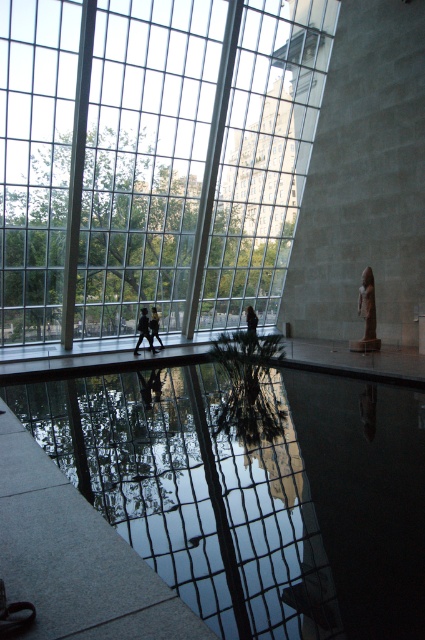
Question: Considering the real-world distances, which object is farthest from the transparent glass pool at center?

Choices:
 (A) dark hair person at center
 (B) matte black suit at center
 (C) transparent glass window at upper left

Answer: (A)

Question: Which of the following is the closest to the observer?

Choices:
 (A) matte brown statue at right
 (B) silhouette figure at center

Answer: (A)

Question: Is transparent glass window at upper left closer to the viewer compared to matte black suit at center?

Choices:
 (A) no
 (B) yes

Answer: (B)

Question: Does matte brown statue at right have a lesser width compared to matte black suit at center?

Choices:
 (A) yes
 (B) no

Answer: (B)

Question: Among these objects, which one is farthest from the camera?

Choices:
 (A) transparent glass window at upper left
 (B) silhouette figure at center

Answer: (B)

Question: Where is transparent glass pool at center located in relation to silhouette figure at center in the image?

Choices:
 (A) below
 (B) above

Answer: (A)